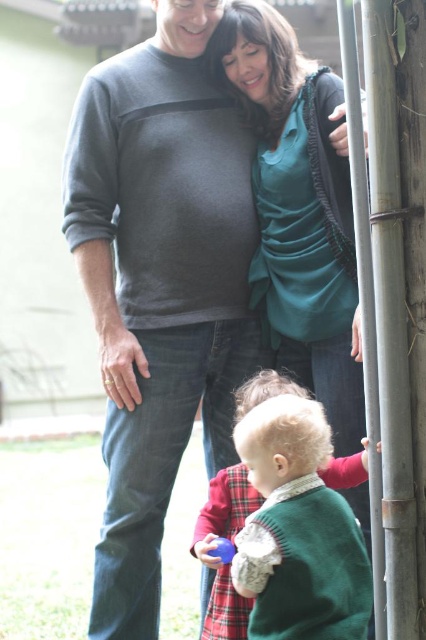
Consider the image. Can you confirm if teal silk blouse at upper center is bigger than smooth gray pole at right?

Yes, teal silk blouse at upper center is bigger than smooth gray pole at right.

Who is lower down, teal silk blouse at upper center or smooth gray pole at right?

smooth gray pole at right

The width and height of the screenshot is (426, 640). I want to click on teal silk blouse at upper center, so click(298, 209).

Is smooth gray pole at right wider than green knitted sweater at lower center?

Incorrect, smooth gray pole at right's width does not surpass green knitted sweater at lower center's.

Can you confirm if smooth gray pole at right is shorter than green knitted sweater at lower center?

In fact, smooth gray pole at right may be taller than green knitted sweater at lower center.

Describe the element at coordinates (400, 291) in the screenshot. I see `smooth gray pole at right` at that location.

The image size is (426, 640). What are the coordinates of `smooth gray pole at right` in the screenshot? It's located at (400, 291).

Measure the distance between dark gray sweater at upper left and camera.

dark gray sweater at upper left and camera are 2.93 meters apart.

Is dark gray sweater at upper left wider than teal silk blouse at upper center?

Indeed, dark gray sweater at upper left has a greater width compared to teal silk blouse at upper center.

Does point (181, 38) lie behind point (356, 339)?

Yes, point (181, 38) is behind point (356, 339).

The image size is (426, 640). What are the coordinates of `dark gray sweater at upper left` in the screenshot? It's located at (160, 284).